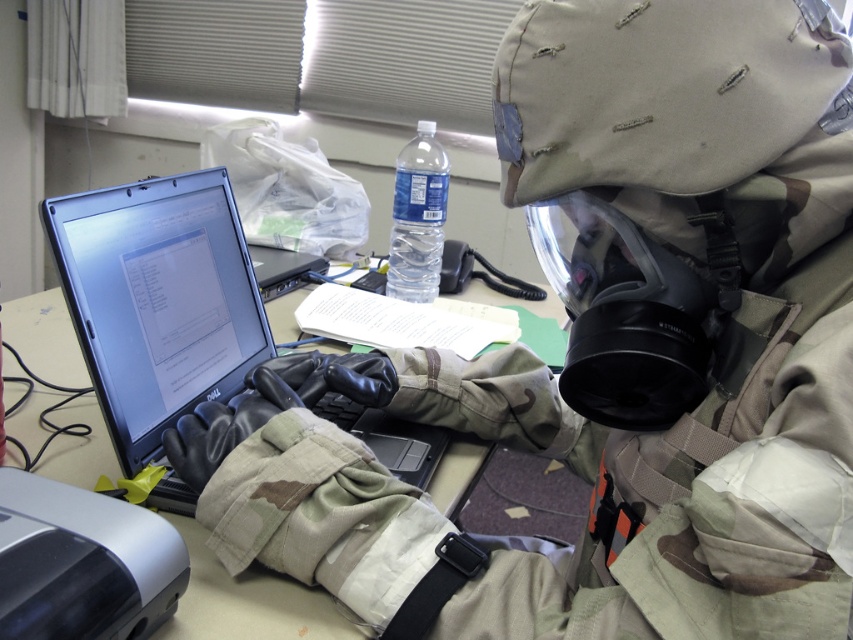
You are a technician trying to locate the matte black laptop at center in the scene. The coordinates given are in a normalized system where the bottom left corner is the origin. Can you confirm if the point at (248, 602) corresponds to the location of the matte black laptop at center?

The point at (248, 602) marks the matte black laptop at center, so yes, the coordinates correspond to its location.

You are a technician trying to locate the matte black laptop at center left on the desk. According to the coordinates provided, where exactly is the matte black laptop positioned?

The matte black laptop at center left is located at point 0.470 on the x axis and 0.186 on the y axis.